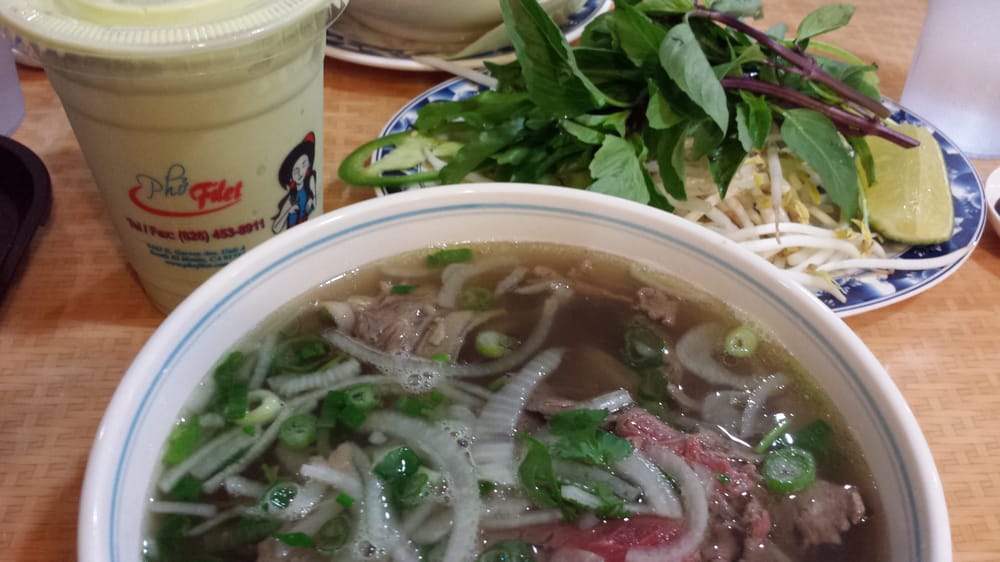
The image size is (1000, 562). I want to click on table, so click(x=970, y=384).